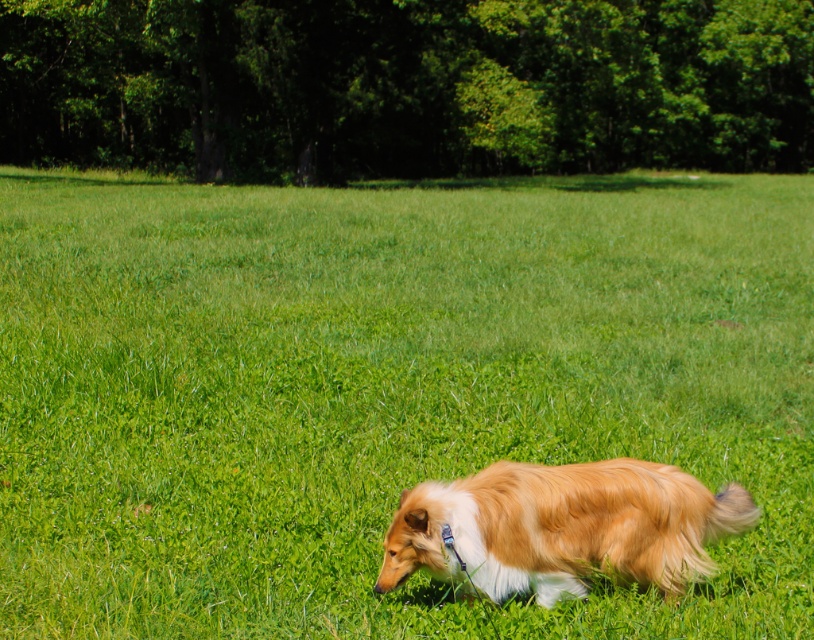
Measure the distance between point (195,589) and camera.

A distance of 16.39 feet exists between point (195,589) and camera.

Is green grassy field at center thinner than golden fur dog at center?

In fact, green grassy field at center might be wider than golden fur dog at center.

Identify the location of green grassy field at center. (384, 392).